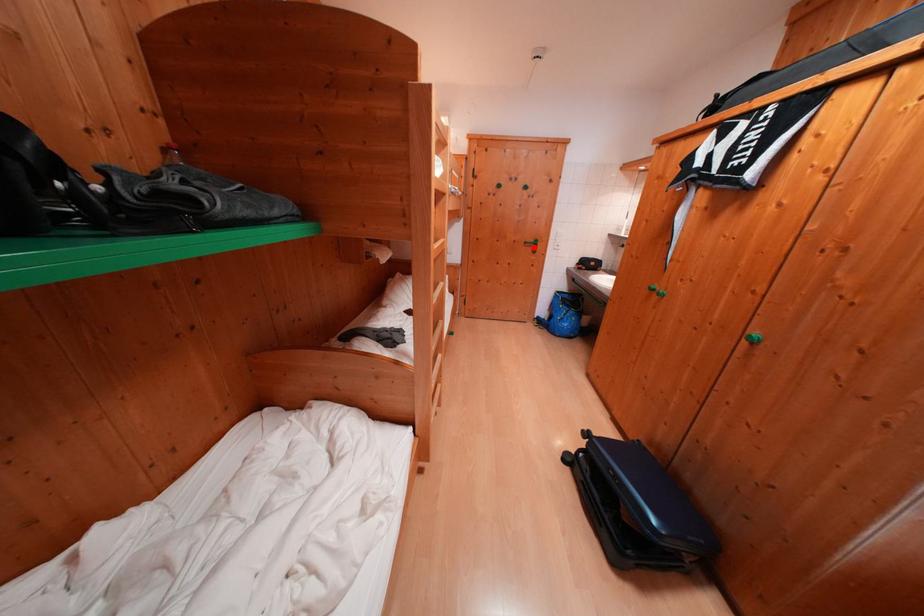
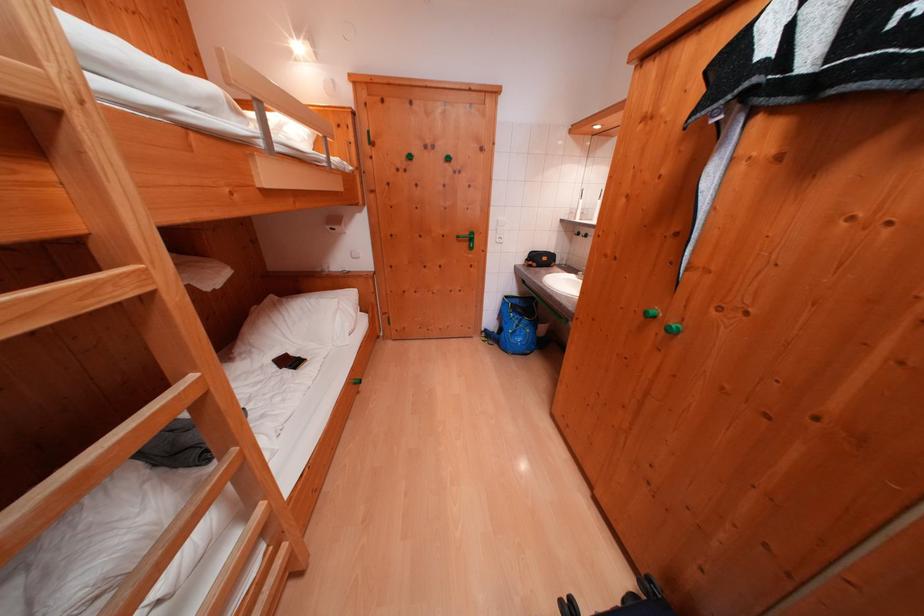
Where in the second image is the point corresponding to the highlighted location from the first image?

(466, 241)